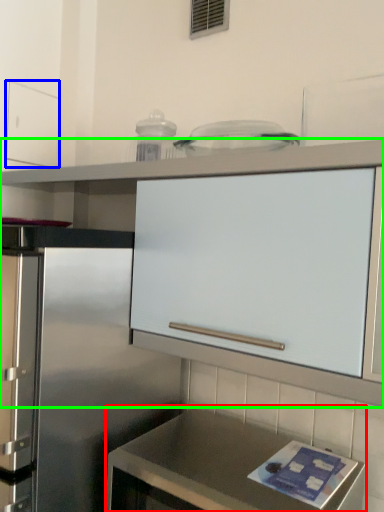
Question: Considering the real-world distances, which object is closest to countertop (highlighted by a red box)? drawer (highlighted by a blue box) or cabinetry (highlighted by a green box).

Choices:
 (A) drawer
 (B) cabinetry

Answer: (B)